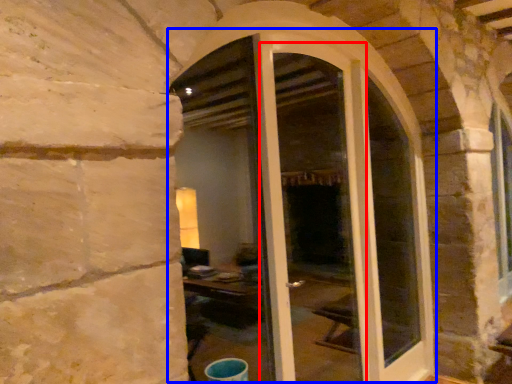
Question: Which point is closer to the camera, screen door (highlighted by a red box) or door (highlighted by a blue box)?

Choices:
 (A) screen door
 (B) door

Answer: (B)